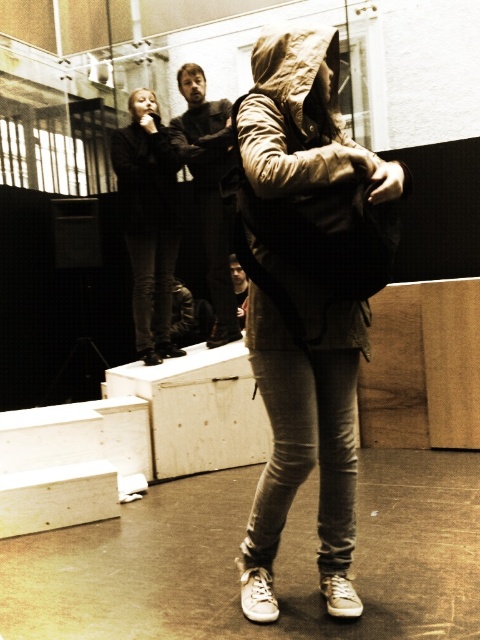
Measure the distance from matte brown jacket at center to black leather jacket at upper left.

matte brown jacket at center is 7.81 feet away from black leather jacket at upper left.

Which is more to the right, matte brown jacket at center or black leather jacket at upper left?

From the viewer's perspective, matte brown jacket at center appears more on the right side.

At what (x,y) coordinates should I click in order to perform the action: click on matte brown jacket at center. Please return your answer as a coordinate pair (x, y). The height and width of the screenshot is (640, 480). Looking at the image, I should click on click(x=308, y=202).

This screenshot has height=640, width=480. Identify the location of matte brown jacket at center. (308, 202).

This screenshot has height=640, width=480. What do you see at coordinates (308, 202) in the screenshot?
I see `matte brown jacket at center` at bounding box center [308, 202].

Is matte brown jacket at center bigger than dark brown leather jacket at center?

Actually, matte brown jacket at center might be smaller than dark brown leather jacket at center.

Between point (404, 173) and point (191, 134), which one is positioned in front?

Positioned in front is point (404, 173).

This screenshot has width=480, height=640. In order to click on matte brown jacket at center in this screenshot , I will do `click(308, 202)`.

Which is more to the right, dark brown leather jacket at center or dark gray hoodie at upper left?

dark brown leather jacket at center

Measure the distance between dark brown leather jacket at center and camera.

dark brown leather jacket at center and camera are 4.33 meters apart from each other.

You are a GUI agent. You are given a task and a screenshot of the screen. Output one action in this format:
    pyautogui.click(x=<x>, y=<y>)
    Task: Click on the dark brown leather jacket at center
    This screenshot has width=480, height=640.
    Given the screenshot: What is the action you would take?
    point(208,189)